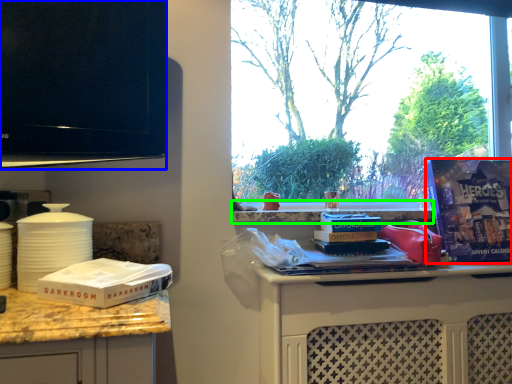
Question: Based on their relative distances, which object is nearer to magazine (highlighted by a red box)? Choose from television (highlighted by a blue box) and window sill (highlighted by a green box).

Choices:
 (A) television
 (B) window sill

Answer: (B)